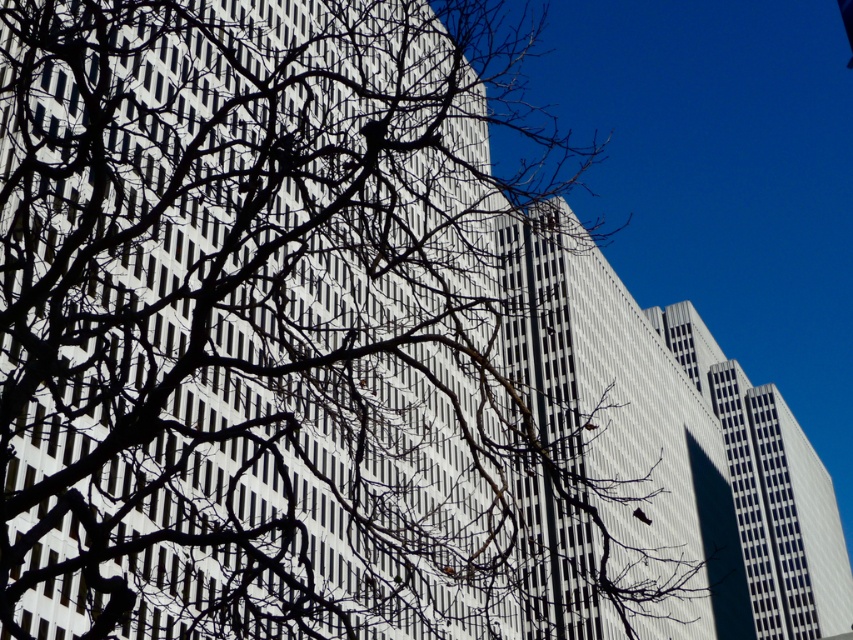
Question: Is white smooth building at center thinner than white glass building at center?

Choices:
 (A) no
 (B) yes

Answer: (B)

Question: Does white smooth building at center have a smaller size compared to white glass building at center?

Choices:
 (A) yes
 (B) no

Answer: (B)

Question: Which point is farther to the camera?

Choices:
 (A) (798, 426)
 (B) (666, 388)

Answer: (A)

Question: Among these objects, which one is farthest from the camera?

Choices:
 (A) white smooth building at center
 (B) white glass building at center

Answer: (B)

Question: Can you confirm if white smooth building at center is smaller than white glass building at center?

Choices:
 (A) yes
 (B) no

Answer: (B)